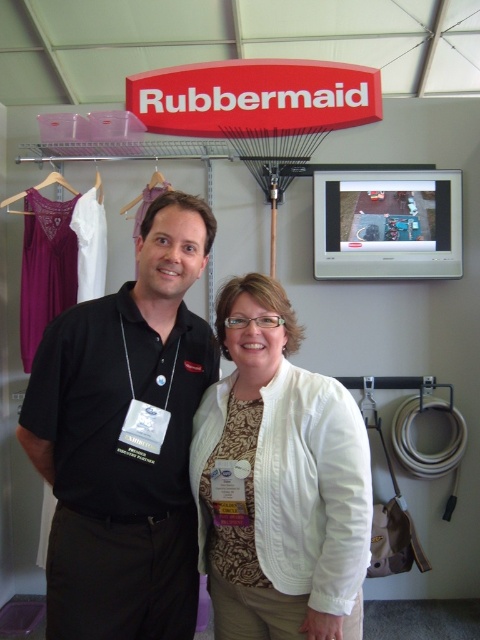
Question: Estimate the real-world distances between objects in this image. Which object is closer to the white fabric hanger at left?

Choices:
 (A) white cotton jacket at center
 (B) purple fabric hanger at upper left

Answer: (B)

Question: Estimate the real-world distances between objects in this image. Which object is closer to the wooden hanger at upper left?

Choices:
 (A) white cotton jacket at center
 (B) purple fabric hanger at upper left
 (C) white fabric hanger at left

Answer: (C)

Question: Which of the following is the farthest from the observer?

Choices:
 (A) white fabric hanger at left
 (B) purple fabric hanger at upper left
 (C) wooden hanger at upper left

Answer: (A)

Question: In this image, where is black shirt at left located relative to white fabric hanger at left?

Choices:
 (A) below
 (B) above

Answer: (A)

Question: Does black shirt at left come behind white cotton jacket at center?

Choices:
 (A) yes
 (B) no

Answer: (A)

Question: Where is white cotton jacket at center located in relation to purple fabric hanger at upper left in the image?

Choices:
 (A) right
 (B) left

Answer: (A)